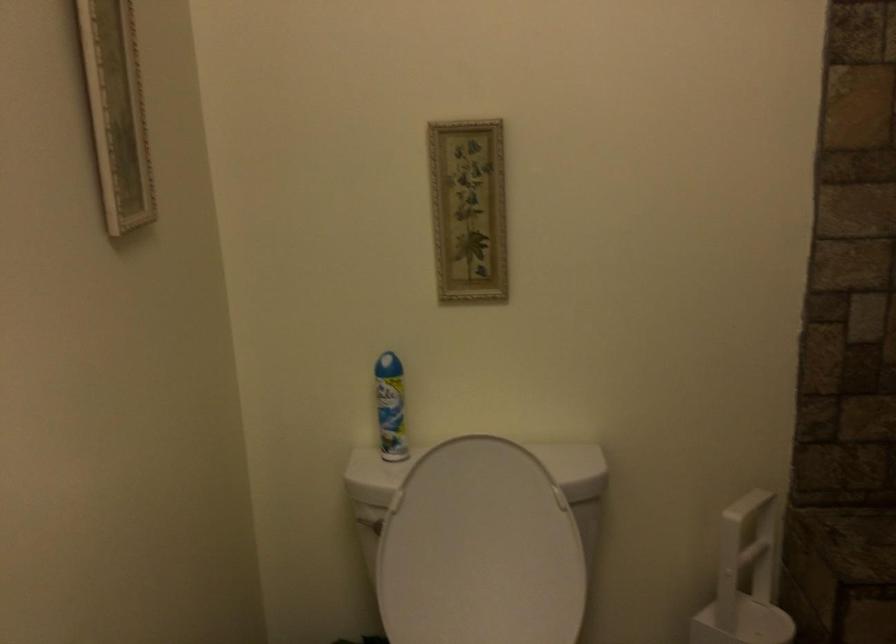
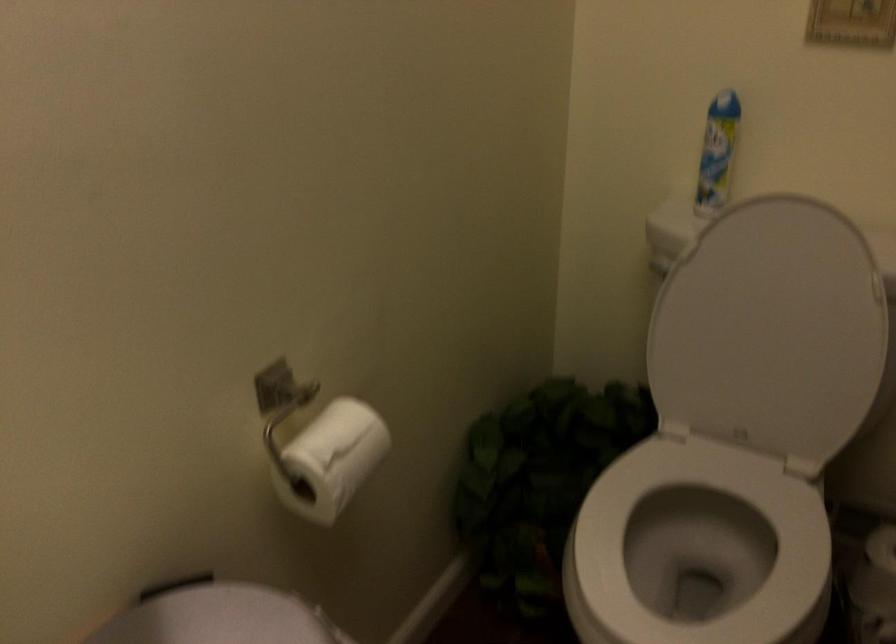
In the second image, find the point that corresponds to [487,556] in the first image.

(771, 330)